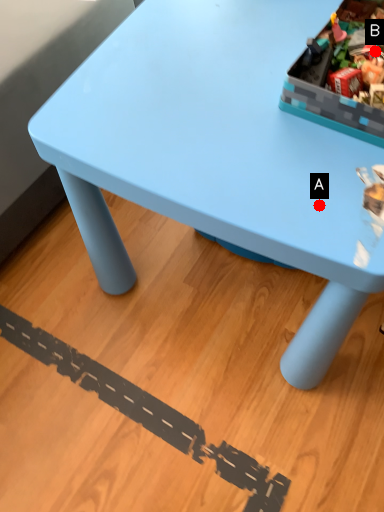
Question: Two points are circled on the image, labeled by A and B beside each circle. Which point is farther from the camera taking this photo?

Choices:
 (A) A is further
 (B) B is further

Answer: (B)